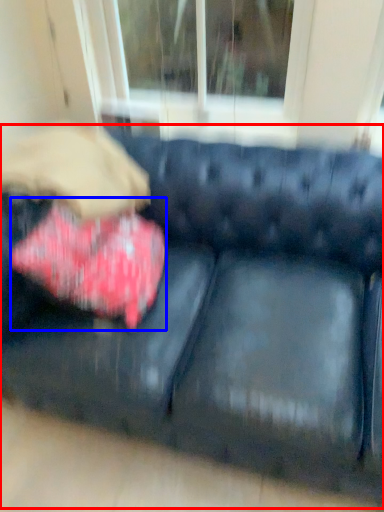
Question: Which point is further to the camera, studio couch (highlighted by a red box) or throw pillow (highlighted by a blue box)?

Choices:
 (A) studio couch
 (B) throw pillow

Answer: (B)